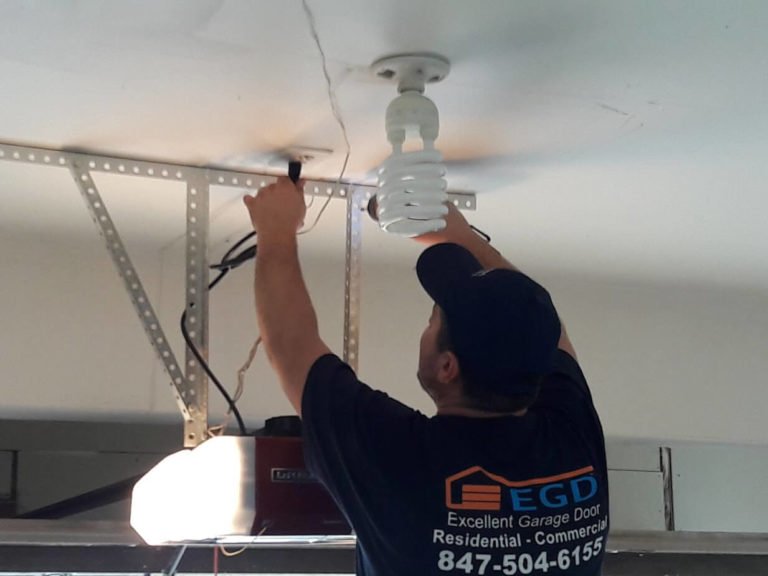
Locate an element on the screen. This screenshot has width=768, height=576. light bulb is located at coordinates (428, 177).